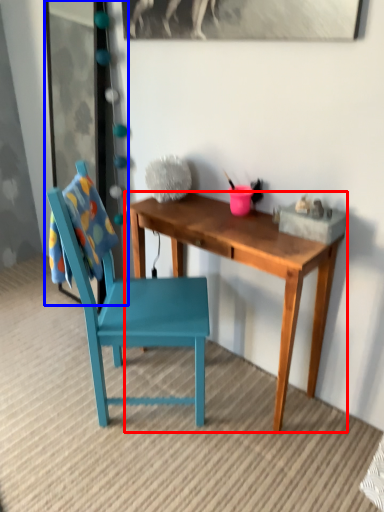
Question: Among these objects, which one is nearest to the camera, desk (highlighted by a red box) or glass door (highlighted by a blue box)?

Choices:
 (A) desk
 (B) glass door

Answer: (A)